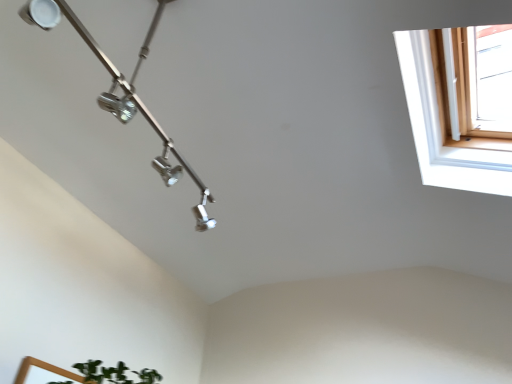
Question: Relative to metallic track lighting at upper left, is white wooden window at upper right in front or behind?

Choices:
 (A) behind
 (B) front

Answer: (A)

Question: Considering the positions of white wooden window at upper right and metallic track lighting at upper left in the image, is white wooden window at upper right taller or shorter than metallic track lighting at upper left?

Choices:
 (A) short
 (B) tall

Answer: (A)

Question: From the image's perspective, is white wooden window at upper right located above or below metallic track lighting at upper left?

Choices:
 (A) below
 (B) above

Answer: (B)

Question: Considering the positions of point (120, 104) and point (424, 74), is point (120, 104) closer or farther from the camera than point (424, 74)?

Choices:
 (A) farther
 (B) closer

Answer: (B)

Question: Is metallic track lighting at upper left taller or shorter than white wooden window at upper right?

Choices:
 (A) short
 (B) tall

Answer: (B)

Question: Is metallic track lighting at upper left situated inside white wooden window at upper right or outside?

Choices:
 (A) inside
 (B) outside

Answer: (B)

Question: From the image's perspective, is metallic track lighting at upper left positioned above or below white wooden window at upper right?

Choices:
 (A) below
 (B) above

Answer: (A)